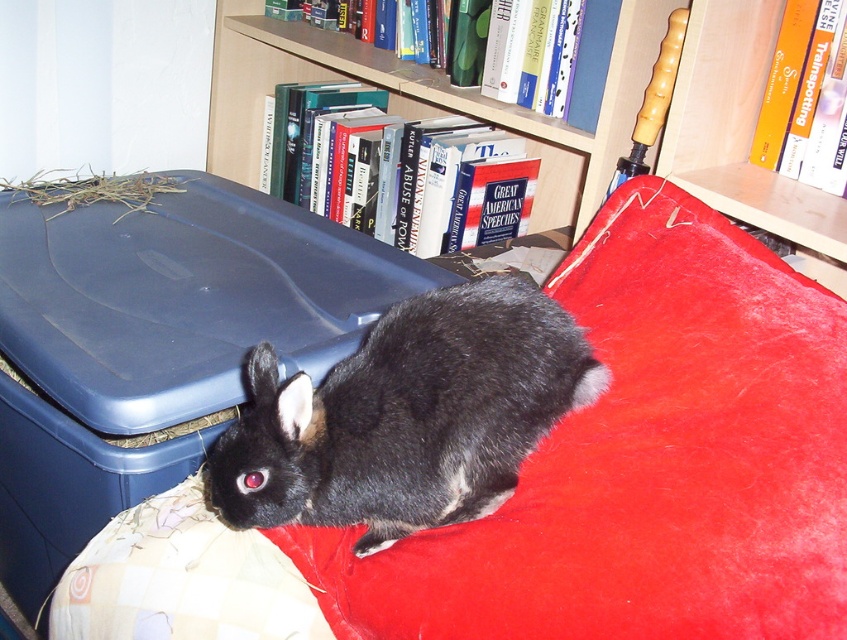
Is the position of velvet red pillow at lower center more distant than that of black fur rabbit at center?

No.

Can you confirm if velvet red pillow at lower center is smaller than black fur rabbit at center?

Actually, velvet red pillow at lower center might be larger than black fur rabbit at center.

Between point (785, 428) and point (364, 369), which one is positioned behind?

The point (364, 369) is behind.

Where is `velvet red pillow at lower center`? This screenshot has width=847, height=640. velvet red pillow at lower center is located at coordinates (646, 461).

Between point (532, 285) and point (261, 17), which one is positioned behind?

The point (261, 17) is more distant.

Does point (444, 445) lie behind point (734, 99)?

That is False.

At what (x,y) coordinates should I click in order to perform the action: click on black fur rabbit at center. Please return your answer as a coordinate pair (x, y). The width and height of the screenshot is (847, 640). Looking at the image, I should click on pos(407,417).

Where is `black fur rabbit at center`? This screenshot has height=640, width=847. black fur rabbit at center is located at coordinates (407, 417).

Is point (460, 552) positioned behind point (634, 88)?

No, it is not.

Who is more distant from viewer, (x=682, y=483) or (x=818, y=237)?

A: Positioned behind is point (x=818, y=237).

Locate an element on the screen. velvet red pillow at lower center is located at coordinates (646, 461).